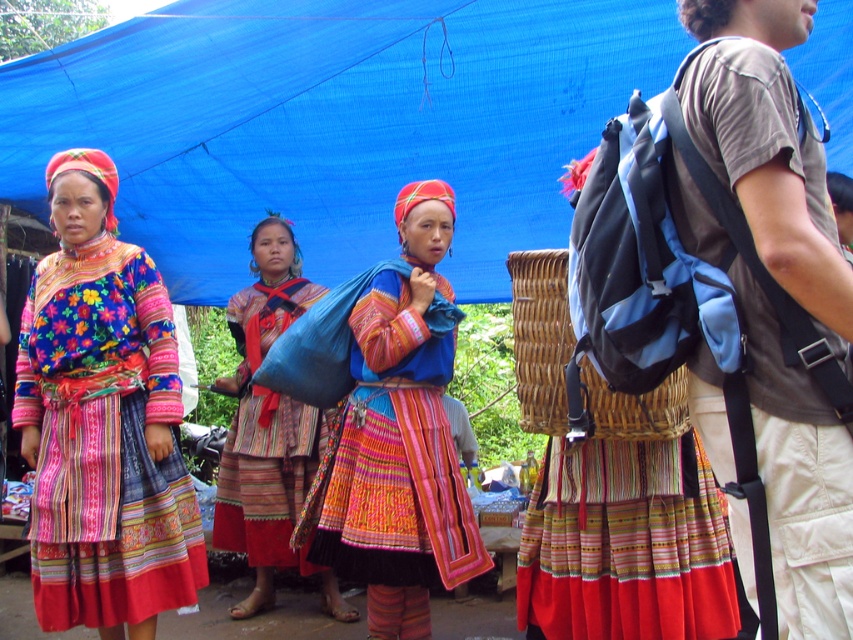
Can you confirm if multicolored woven skirt at center is bigger than textured woven bag at center?

Incorrect, multicolored woven skirt at center is not larger than textured woven bag at center.

Can you confirm if multicolored woven skirt at center is positioned to the left of textured woven bag at center?

Incorrect, multicolored woven skirt at center is not on the left side of textured woven bag at center.

Where is `multicolored woven skirt at center`? multicolored woven skirt at center is located at coordinates (392, 451).

Is blue fabric canopy at upper center to the left of textured woven bag at center from the viewer's perspective?

No, blue fabric canopy at upper center is not to the left of textured woven bag at center.

Does point (80, 61) come in front of point (293, 472)?

Yes.

Find the location of `blue fabric canopy at upper center`. blue fabric canopy at upper center is located at coordinates (334, 122).

Between brown cotton shirt at right and multicolored woven skirt at center, which one has less height?

multicolored woven skirt at center is shorter.

Is point (816, 300) positioned behind point (360, 323)?

No, it is not.

Identify the location of brown cotton shirt at right. This screenshot has width=853, height=640. 767,147.